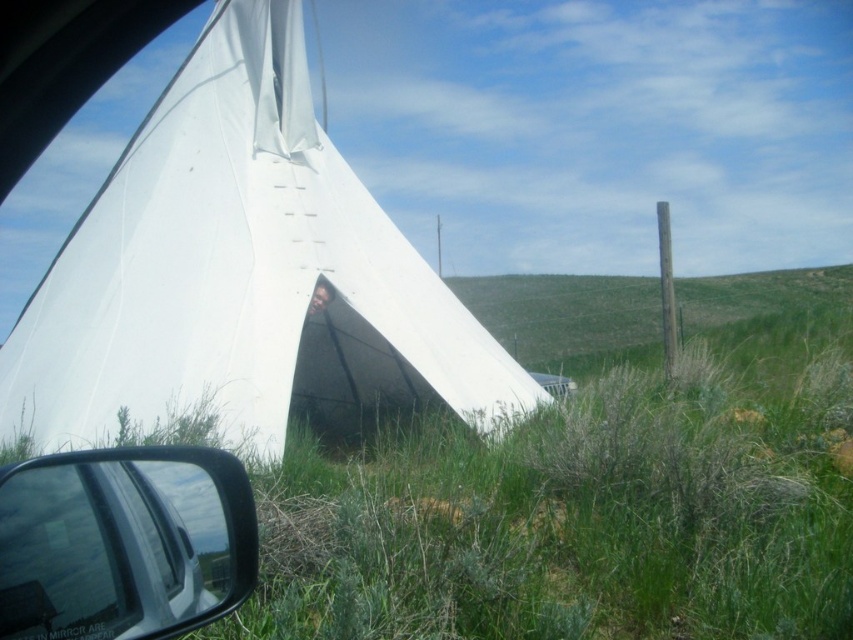
Question: Among these points, which one is nearest to the camera?

Choices:
 (A) (233, 330)
 (B) (28, 604)

Answer: (B)

Question: Does white canvas tent at center have a larger size compared to black plastic side mirror at lower left?

Choices:
 (A) yes
 (B) no

Answer: (A)

Question: Is the position of white canvas tent at center less distant than that of black plastic side mirror at lower left?

Choices:
 (A) yes
 (B) no

Answer: (B)

Question: Is white canvas tent at center wider than black plastic side mirror at lower left?

Choices:
 (A) yes
 (B) no

Answer: (A)